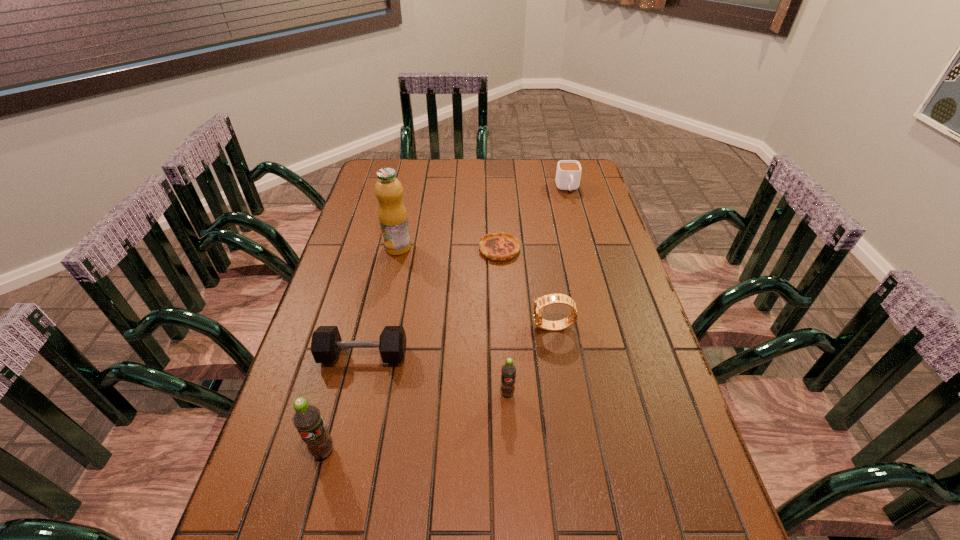
Identify the location of the taller soda. The image size is (960, 540). (307, 419).

Find the location of a particular element. This screenshot has height=540, width=960. the second tallest object is located at coordinates (307, 419).

The width and height of the screenshot is (960, 540). Identify the location of the right soda. (508, 370).

You are a GUI agent. You are given a task and a screenshot of the screen. Output one action in this format:
    pyautogui.click(x=<x>, y=<y>)
    Task: Click on the shorter soda
    
    Given the screenshot: What is the action you would take?
    pyautogui.click(x=508, y=370)

The height and width of the screenshot is (540, 960). Identify the location of quiche. (501, 246).

The height and width of the screenshot is (540, 960). In order to click on cup in this screenshot , I will do `click(568, 174)`.

In order to click on the rightmost object in this screenshot , I will do `click(568, 174)`.

You are a GUI agent. You are given a task and a screenshot of the screen. Output one action in this format:
    pyautogui.click(x=<x>, y=<y>)
    Task: Click on the fruit juice
    
    Given the screenshot: What is the action you would take?
    pyautogui.click(x=392, y=214)

Locate an element on the screen. the fourth tallest object is located at coordinates (541, 302).

Locate an element on the screen. The image size is (960, 540). the second object from right to left is located at coordinates (541, 302).